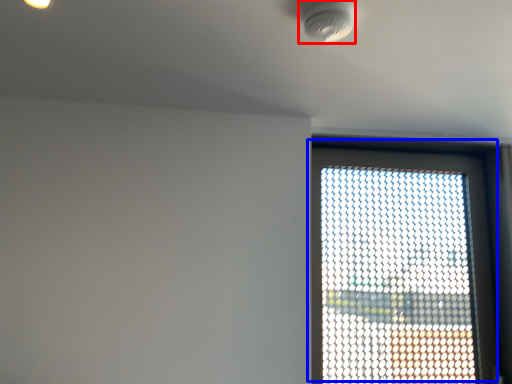
Question: Among these objects, which one is farthest to the camera, light fixture (highlighted by a red box) or window (highlighted by a blue box)?

Choices:
 (A) light fixture
 (B) window

Answer: (B)